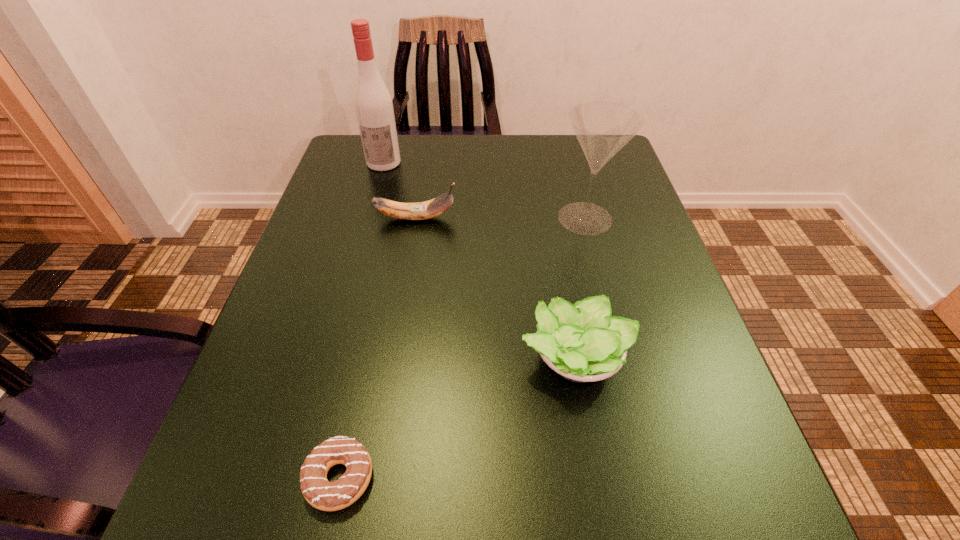
Locate an element on the screen. This screenshot has width=960, height=540. the farthest object is located at coordinates (373, 104).

Find the location of a particular element. Image resolution: width=960 pixels, height=540 pixels. the tallest object is located at coordinates (373, 104).

Image resolution: width=960 pixels, height=540 pixels. Identify the location of the fourth shortest object. (602, 128).

Identify the location of banana. (429, 209).

Locate an element on the screen. the second shortest object is located at coordinates (582, 342).

Locate an element on the screen. This screenshot has width=960, height=540. the second nearest object is located at coordinates (582, 342).

This screenshot has width=960, height=540. In order to click on doughnut in this screenshot , I will do `click(320, 493)`.

Locate an element on the screen. The width and height of the screenshot is (960, 540). the shortest object is located at coordinates (320, 493).

You are a GUI agent. You are given a task and a screenshot of the screen. Output one action in this format:
    pyautogui.click(x=<x>, y=<y>)
    Task: Click on the vacant region located 0.250m on the label of the farthest object
    The image size is (960, 540).
    Given the screenshot: What is the action you would take?
    pyautogui.click(x=362, y=240)

Where is `free space located 0.330m on the left of the second tallest object`? The width and height of the screenshot is (960, 540). free space located 0.330m on the left of the second tallest object is located at coordinates (400, 218).